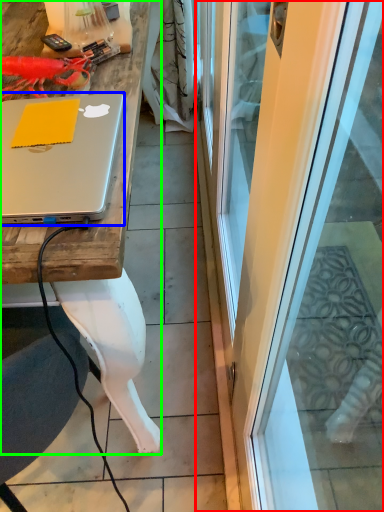
Question: Which object is the farthest from screen door (highlighted by a red box)? Choose among these: laptop (highlighted by a blue box) or desk (highlighted by a green box).

Choices:
 (A) laptop
 (B) desk

Answer: (A)